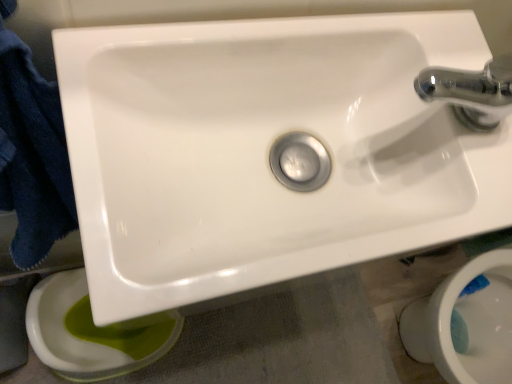
Locate an element on the screen. The width and height of the screenshot is (512, 384). white glossy sink at center is located at coordinates (267, 151).

Where is `dark blue towel at left`? dark blue towel at left is located at coordinates (32, 152).

What is the approximate height of dark blue towel at left?

The height of dark blue towel at left is 53.86 centimeters.

Where is `green glossy toilet bowl at lower left, arranged as the second toilet bowl when viewed from the right`? This screenshot has width=512, height=384. green glossy toilet bowl at lower left, arranged as the second toilet bowl when viewed from the right is located at coordinates (89, 333).

Describe the element at coordinates (89, 333) in the screenshot. I see `green glossy toilet bowl at lower left, arranged as the second toilet bowl when viewed from the right` at that location.

Where is `white glossy toilet bowl at lower right, the second toilet bowl positioned from the left`? The width and height of the screenshot is (512, 384). white glossy toilet bowl at lower right, the second toilet bowl positioned from the left is located at coordinates (467, 323).

Identify the location of white glossy sink at center. Image resolution: width=512 pixels, height=384 pixels. (267, 151).

Considering the relative positions of green glossy toilet bowl at lower left, arranged as the second toilet bowl when viewed from the right, and white glossy toilet bowl at lower right, the second toilet bowl positioned from the left, in the image provided, is green glossy toilet bowl at lower left, arranged as the second toilet bowl when viewed from the right, in front of white glossy toilet bowl at lower right, the second toilet bowl positioned from the left,?

No, green glossy toilet bowl at lower left, arranged as the second toilet bowl when viewed from the right, is further to the viewer.

Does green glossy toilet bowl at lower left, the 1th toilet bowl viewed from the left, have a lesser height compared to white glossy toilet bowl at lower right, which is the first toilet bowl from right to left?

Correct, green glossy toilet bowl at lower left, the 1th toilet bowl viewed from the left, is not as tall as white glossy toilet bowl at lower right, which is the first toilet bowl from right to left.

Is green glossy toilet bowl at lower left, arranged as the second toilet bowl when viewed from the right, oriented away from white glossy toilet bowl at lower right, the second toilet bowl positioned from the left?

That's not correct — green glossy toilet bowl at lower left, arranged as the second toilet bowl when viewed from the right, is not looking away from white glossy toilet bowl at lower right, the second toilet bowl positioned from the left.

Is point (412, 334) farther from camera compared to point (86, 347)?

Yes, point (412, 334) is farther from viewer.

Based on the photo, in terms of size, does white glossy toilet bowl at lower right, which is the first toilet bowl from right to left, appear bigger or smaller than green glossy toilet bowl at lower left, the 1th toilet bowl viewed from the left?

white glossy toilet bowl at lower right, which is the first toilet bowl from right to left, is bigger than green glossy toilet bowl at lower left, the 1th toilet bowl viewed from the left.

Is white glossy toilet bowl at lower right, the second toilet bowl positioned from the left, positioned with its back to green glossy toilet bowl at lower left, the 1th toilet bowl viewed from the left?

No.

Considering the relative sizes of white glossy toilet bowl at lower right, which is the first toilet bowl from right to left, and green glossy toilet bowl at lower left, the 1th toilet bowl viewed from the left, in the image provided, is white glossy toilet bowl at lower right, which is the first toilet bowl from right to left, shorter than green glossy toilet bowl at lower left, the 1th toilet bowl viewed from the left,?

No.

Which is nearer, [67,285] or [251,198]?

Clearly, point [67,285] is more distant from the camera than point [251,198].

Is green glossy toilet bowl at lower left, the 1th toilet bowl viewed from the left, aimed at white glossy sink at center?

No.

Is green glossy toilet bowl at lower left, the 1th toilet bowl viewed from the left, positioned beyond the bounds of white glossy sink at center?

Yes, green glossy toilet bowl at lower left, the 1th toilet bowl viewed from the left, is outside of white glossy sink at center.

From the image's perspective, count 2nd toilet bowls downward from the white glossy sink at center and point to it. Please provide its 2D coordinates.

[(467, 323)]

Considering their positions, is white glossy toilet bowl at lower right, which is the first toilet bowl from right to left, located in front of or behind white glossy sink at center?

Visually, white glossy toilet bowl at lower right, which is the first toilet bowl from right to left, is located behind white glossy sink at center.

Could you measure the distance between white glossy toilet bowl at lower right, which is the first toilet bowl from right to left, and white glossy sink at center?

They are 29.73 inches apart.

Between white glossy toilet bowl at lower right, which is the first toilet bowl from right to left, and white glossy sink at center, which one has larger size?

white glossy toilet bowl at lower right, which is the first toilet bowl from right to left.

Is white glossy toilet bowl at lower right, the second toilet bowl positioned from the left, closer to camera compared to dark blue towel at left?

No.

Considering the relative sizes of white glossy toilet bowl at lower right, the second toilet bowl positioned from the left, and dark blue towel at left in the image provided, is white glossy toilet bowl at lower right, the second toilet bowl positioned from the left, smaller than dark blue towel at left?

No.

Between point (486, 322) and point (21, 99), which one is positioned behind?

The point (486, 322) is more distant.

Locate an element on the screen. bath towel above the white glossy toilet bowl at lower right, the second toilet bowl positioned from the left (from the image's perspective) is located at coordinates (32, 152).

From a real-world perspective, does dark blue towel at left sit lower than white glossy toilet bowl at lower right, the second toilet bowl positioned from the left?

No, from a real-world perspective, dark blue towel at left is not below white glossy toilet bowl at lower right, the second toilet bowl positioned from the left.

Is dark blue towel at left to the left or to the right of white glossy toilet bowl at lower right, which is the first toilet bowl from right to left, in the image?

In the image, dark blue towel at left appears on the left side of white glossy toilet bowl at lower right, which is the first toilet bowl from right to left.

Is point (24, 223) positioned behind point (446, 348)?

No, (24, 223) is closer to viewer.

From a real-world perspective, which object stands above the other?

white glossy sink at center is physically above.

Who is more distant, white glossy sink at center or green glossy toilet bowl at lower left, the 1th toilet bowl viewed from the left?

green glossy toilet bowl at lower left, the 1th toilet bowl viewed from the left, is behind.

Is point (216, 243) more distant than point (42, 330)?

No.

Image resolution: width=512 pixels, height=384 pixels. Identify the location of toilet bowl to the left of white glossy toilet bowl at lower right, which is the first toilet bowl from right to left. (89, 333).

You are a GUI agent. You are given a task and a screenshot of the screen. Output one action in this format:
    pyautogui.click(x=<x>, y=<y>)
    Task: Click on the toilet bowl located underneath the white glossy toilet bowl at lower right, the second toilet bowl positioned from the left (from a real-world perspective)
    The width and height of the screenshot is (512, 384).
    Given the screenshot: What is the action you would take?
    pyautogui.click(x=89, y=333)

Looking at the image, which one is located further to green glossy toilet bowl at lower left, arranged as the second toilet bowl when viewed from the right, white glossy sink at center or white glossy toilet bowl at lower right, the second toilet bowl positioned from the left?

The object further to green glossy toilet bowl at lower left, arranged as the second toilet bowl when viewed from the right, is white glossy toilet bowl at lower right, the second toilet bowl positioned from the left.

Considering their positions, is white glossy sink at center positioned further to dark blue towel at left than white glossy toilet bowl at lower right, the second toilet bowl positioned from the left?

white glossy toilet bowl at lower right, the second toilet bowl positioned from the left, lies further to dark blue towel at left than the other object.

From the image, which object appears to be farther from white glossy sink at center, white glossy toilet bowl at lower right, the second toilet bowl positioned from the left, or green glossy toilet bowl at lower left, the 1th toilet bowl viewed from the left?

white glossy toilet bowl at lower right, the second toilet bowl positioned from the left, is positioned further to the anchor white glossy sink at center.

Estimate the real-world distances between objects in this image. Which object is closer to green glossy toilet bowl at lower left, arranged as the second toilet bowl when viewed from the right, white glossy toilet bowl at lower right, which is the first toilet bowl from right to left, or dark blue towel at left?

Among the two, dark blue towel at left is located nearer to green glossy toilet bowl at lower left, arranged as the second toilet bowl when viewed from the right.

Based on their spatial positions, is green glossy toilet bowl at lower left, the 1th toilet bowl viewed from the left, or white glossy toilet bowl at lower right, the second toilet bowl positioned from the left, closer to dark blue towel at left?

green glossy toilet bowl at lower left, the 1th toilet bowl viewed from the left.

From the image, which object appears to be farther from dark blue towel at left, white glossy toilet bowl at lower right, which is the first toilet bowl from right to left, or white glossy sink at center?

Based on the image, white glossy toilet bowl at lower right, which is the first toilet bowl from right to left, appears to be further to dark blue towel at left.

Looking at the image, which one is located closer to green glossy toilet bowl at lower left, arranged as the second toilet bowl when viewed from the right, white glossy sink at center or dark blue towel at left?

dark blue towel at left.

Looking at the image, which one is located further to green glossy toilet bowl at lower left, the 1th toilet bowl viewed from the left, white glossy toilet bowl at lower right, which is the first toilet bowl from right to left, or white glossy sink at center?

white glossy toilet bowl at lower right, which is the first toilet bowl from right to left, is further to green glossy toilet bowl at lower left, the 1th toilet bowl viewed from the left.

At what (x,y) coordinates should I click in order to perform the action: click on bath towel between green glossy toilet bowl at lower left, arranged as the second toilet bowl when viewed from the right, and white glossy toilet bowl at lower right, the second toilet bowl positioned from the left, in the horizontal direction. Please return your answer as a coordinate pair (x, y). Looking at the image, I should click on (32, 152).

Find the location of a particular element. This screenshot has width=512, height=384. sink located between green glossy toilet bowl at lower left, arranged as the second toilet bowl when viewed from the right, and white glossy toilet bowl at lower right, the second toilet bowl positioned from the left, in the left-right direction is located at coordinates (267, 151).

Identify the location of sink located between dark blue towel at left and white glossy toilet bowl at lower right, the second toilet bowl positioned from the left, in the left-right direction. (267, 151).

Find the location of `sink between dark blue towel at left and green glossy toilet bowl at lower left, the 1th toilet bowl viewed from the left, from front to back`. sink between dark blue towel at left and green glossy toilet bowl at lower left, the 1th toilet bowl viewed from the left, from front to back is located at coordinates (267, 151).